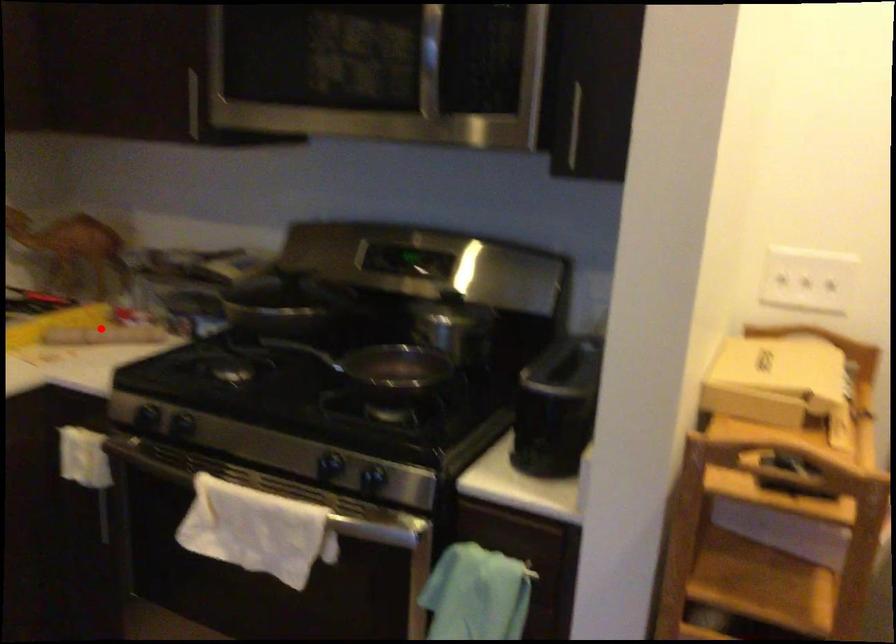
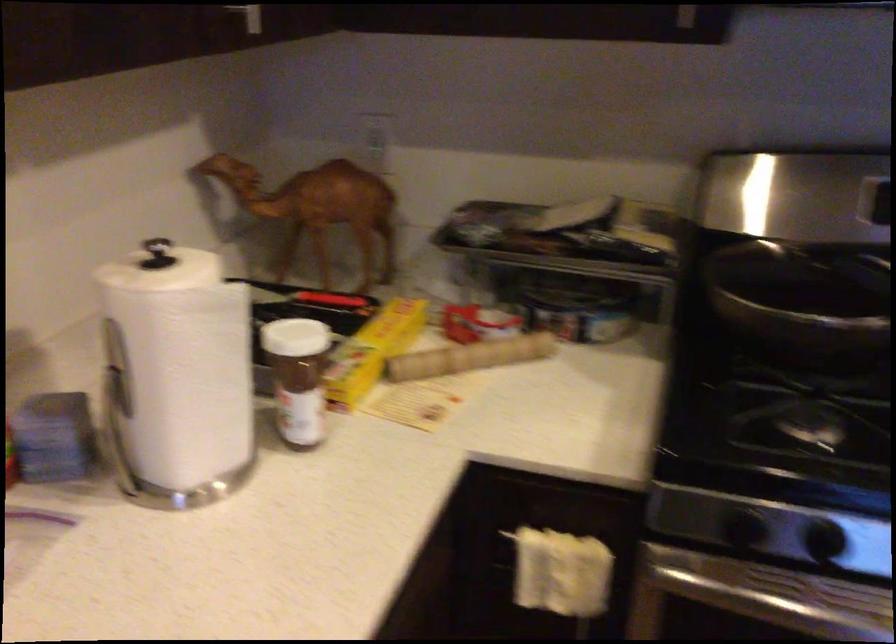
The point at the highlighted location is marked in the first image. Where is the corresponding point in the second image?

(469, 357)